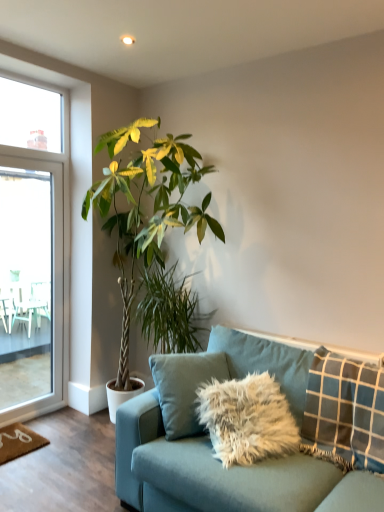
Question: Is point (33, 333) positioned closer to the camera than point (264, 463)?

Choices:
 (A) closer
 (B) farther

Answer: (B)

Question: From a real-world perspective, is transparent glass screen door at left above or below teal fabric couch at lower right?

Choices:
 (A) above
 (B) below

Answer: (A)

Question: Which is nearer to the green leafy plant at center, which is the 2th houseplant in top-to-bottom order?

Choices:
 (A) teal fabric couch at lower right
 (B) green leafy plant at center, which is counted as the first houseplant, starting from the top
 (C) blue checkered pillow at right
 (D) transparent glass screen door at left

Answer: (B)

Question: Which of these objects is positioned closest to the teal fabric couch at lower right?

Choices:
 (A) green leafy plant at center, the 2th houseplant in the bottom-to-top sequence
 (B) green leafy plant at center, which is the 2th houseplant in top-to-bottom order
 (C) blue checkered pillow at right
 (D) transparent glass screen door at left

Answer: (C)